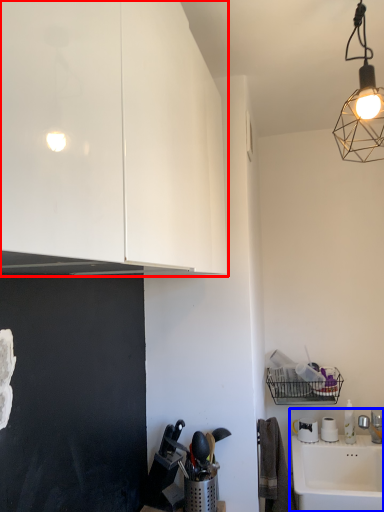
Question: Which object is closer to the camera taking this photo, cabinetry (highlighted by a red box) or sink (highlighted by a blue box)?

Choices:
 (A) cabinetry
 (B) sink

Answer: (A)